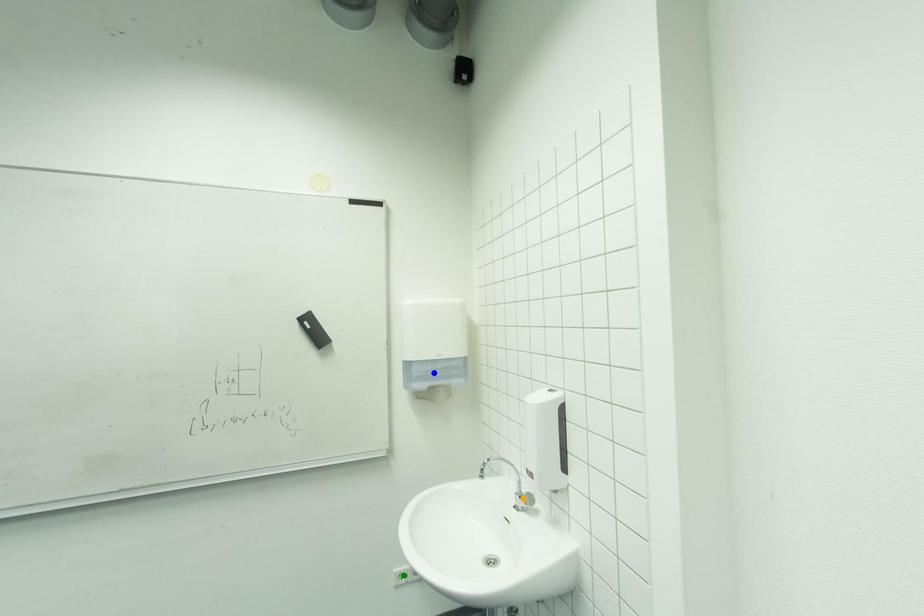
Order these from nearest to farthest:
A) orange point
B) green point
C) blue point

green point < blue point < orange point